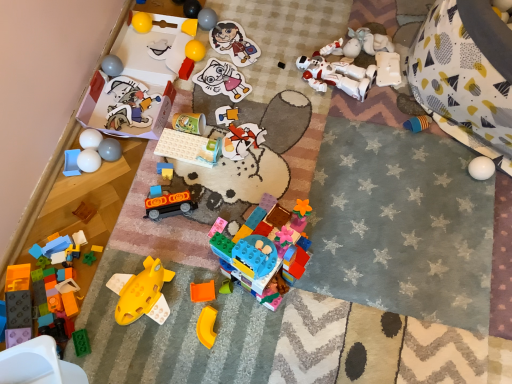
The width and height of the screenshot is (512, 384). In order to click on free space behind orange matte toy airplane at center, which is the eighth toy from right to left in this screenshot , I will do `click(195, 241)`.